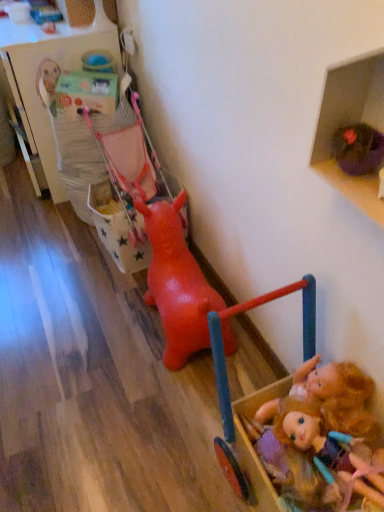
Question: Is plush blonde doll at lower right wider or thinner than rubber pink baby carriage at center-left?

Choices:
 (A) wide
 (B) thin

Answer: (B)

Question: From the image's perspective, is plush blonde doll at lower right positioned above or below rubber pink baby carriage at center-left?

Choices:
 (A) below
 (B) above

Answer: (A)

Question: Considering the real-world distances, which object is farthest from the rubber dog at center, which appears as the 1th toy when viewed from the back?

Choices:
 (A) purple fabric basket at upper right, acting as the 1th shelf starting from the front
 (B) wooden toy box at upper left, acting as the first shelf starting from the top
 (C) wooden dollhouse at lower right, arranged as the second toy when viewed from the back
 (D) rubber pink baby carriage at center-left
 (E) plush blonde doll at lower right

Answer: (B)

Question: Which object is the closest to the rubber pink baby carriage at center-left?

Choices:
 (A) purple fabric basket at upper right, the second shelf positioned from the back
 (B) wooden dollhouse at lower right, which is the 1th toy from front to back
 (C) plush blonde doll at lower right
 (D) rubber dog at center, arranged as the 2th toy when viewed from the front
 (E) wooden toy box at upper left, acting as the first shelf starting from the top

Answer: (D)